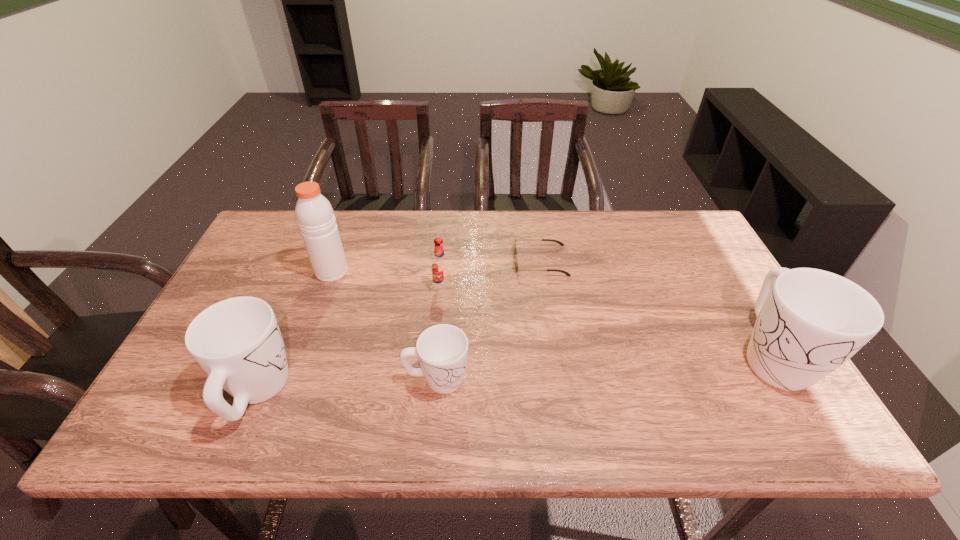
This screenshot has height=540, width=960. Identify the location of the leftmost mug. (237, 341).

Locate an element on the screen. The image size is (960, 540). the shortest mug is located at coordinates (442, 350).

Locate an element on the screen. the second mug from left to right is located at coordinates (442, 350).

Identify the location of the rightmost object. This screenshot has height=540, width=960. 809,322.

At what (x,y) coordinates should I click in order to perform the action: click on the tallest object. Please return your answer as a coordinate pair (x, y). Image resolution: width=960 pixels, height=540 pixels. Looking at the image, I should click on (x=315, y=217).

At what (x,y) coordinates should I click in order to perform the action: click on the shortest object. Please return your answer as a coordinate pair (x, y). Looking at the image, I should click on click(515, 249).

The image size is (960, 540). I want to click on sunglasses, so 515,249.

The image size is (960, 540). I want to click on the third shortest object, so click(440, 267).

This screenshot has width=960, height=540. I want to click on vacant space located on the side of the second shortest mug with the handle, so click(x=287, y=322).

This screenshot has height=540, width=960. Identify the location of vacant space situated 0.110m on the side of the second shortest mug with the handle. click(x=288, y=319).